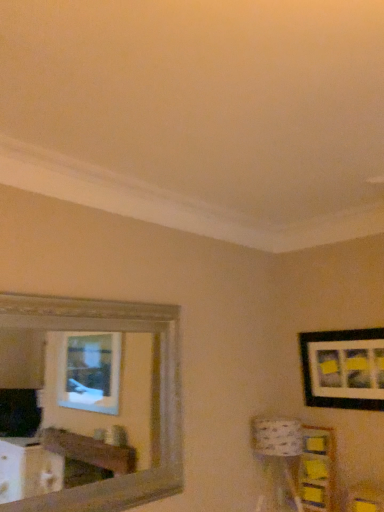
Question: Is wooden frame mirror at upper left aimed at black matte picture frame at upper right?

Choices:
 (A) yes
 (B) no

Answer: (B)

Question: Is wooden frame mirror at upper left at the right side of black matte picture frame at upper right?

Choices:
 (A) no
 (B) yes

Answer: (A)

Question: Does wooden frame mirror at upper left have a lesser width compared to black matte picture frame at upper right?

Choices:
 (A) yes
 (B) no

Answer: (B)

Question: Is black matte picture frame at upper right at the back of wooden frame mirror at upper left?

Choices:
 (A) no
 (B) yes

Answer: (A)

Question: From the image's perspective, is wooden frame mirror at upper left located beneath black matte picture frame at upper right?

Choices:
 (A) no
 (B) yes

Answer: (A)

Question: Considering the relative positions of yellow paper at lower right and wooden frame mirror at upper left in the image provided, is yellow paper at lower right to the left or to the right of wooden frame mirror at upper left?

Choices:
 (A) left
 (B) right

Answer: (B)

Question: From the image's perspective, relative to wooden frame mirror at upper left, is yellow paper at lower right above or below?

Choices:
 (A) above
 (B) below

Answer: (B)

Question: Is yellow paper at lower right inside or outside of wooden frame mirror at upper left?

Choices:
 (A) inside
 (B) outside

Answer: (B)

Question: In the image, is yellow paper at lower right positioned in front of or behind wooden frame mirror at upper left?

Choices:
 (A) behind
 (B) front

Answer: (A)

Question: Is black matte picture frame at upper right spatially inside yellow paper at lower right, or outside of it?

Choices:
 (A) inside
 (B) outside

Answer: (B)

Question: Considering the relative positions of black matte picture frame at upper right and yellow paper at lower right in the image provided, is black matte picture frame at upper right to the left or to the right of yellow paper at lower right?

Choices:
 (A) left
 (B) right

Answer: (B)

Question: From a real-world perspective, is black matte picture frame at upper right above or below yellow paper at lower right?

Choices:
 (A) below
 (B) above

Answer: (B)

Question: From their relative heights in the image, would you say black matte picture frame at upper right is taller or shorter than yellow paper at lower right?

Choices:
 (A) tall
 (B) short

Answer: (B)

Question: Looking at the image, does wooden frame mirror at upper left seem bigger or smaller compared to black matte picture frame at upper right?

Choices:
 (A) big
 (B) small

Answer: (A)

Question: Does point (87, 504) appear closer or farther from the camera than point (299, 344)?

Choices:
 (A) closer
 (B) farther

Answer: (A)